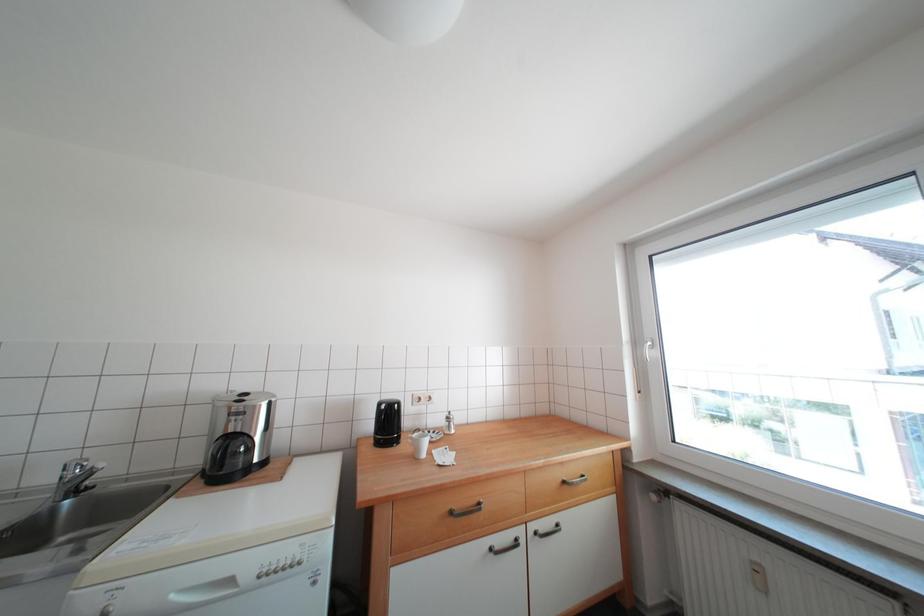
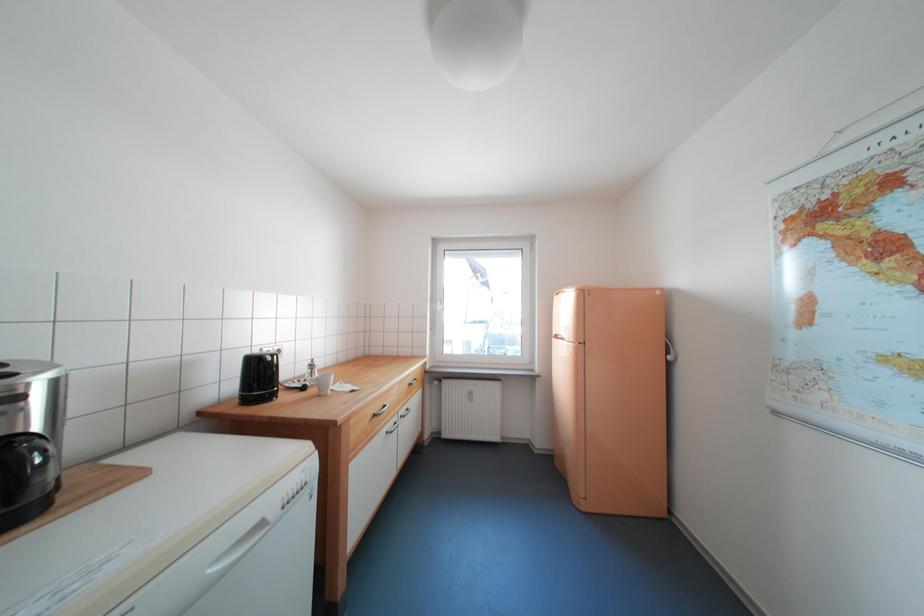
Question: The images are taken continuously from a first-person perspective. In which direction is your viewpoint rotating?

Choices:
 (A) Left
 (B) Right
 (C) Up
 (D) Down

Answer: (B)